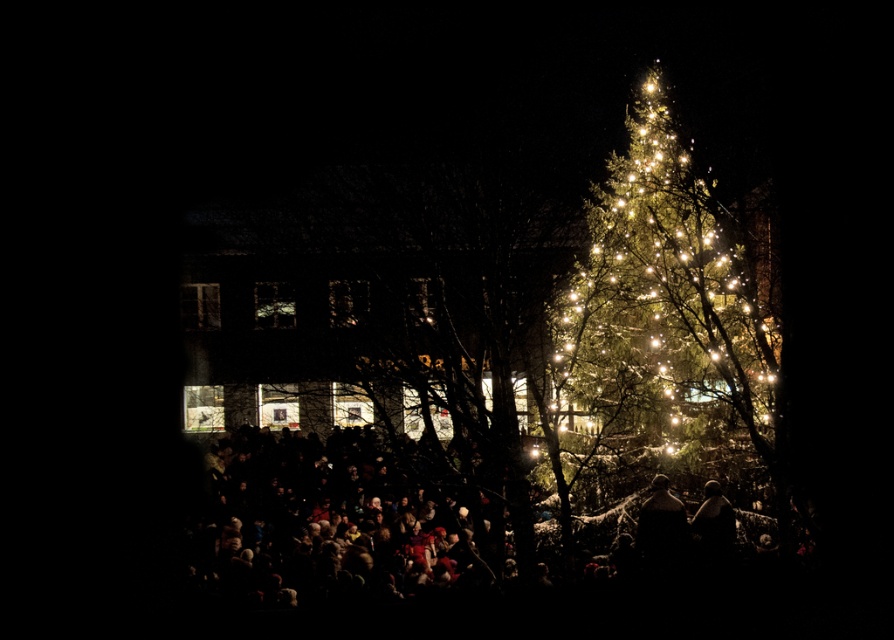
Question: Can you confirm if illuminated green pine at right is positioned to the right of brown leather jacket at lower right?

Choices:
 (A) no
 (B) yes

Answer: (A)

Question: Which object appears closest to the camera in this image?

Choices:
 (A) snow-covered crowd at lower center
 (B) brown leather jacket at lower right
 (C) illuminated green pine at right

Answer: (A)

Question: Can you confirm if illuminated green pine at right is positioned above brown leather jacket at lower right?

Choices:
 (A) no
 (B) yes

Answer: (B)

Question: Can you confirm if snow-covered crowd at lower center is thinner than brown leather jacket at lower right?

Choices:
 (A) yes
 (B) no

Answer: (B)

Question: Which point is closer to the camera?

Choices:
 (A) [237, 605]
 (B) [762, 312]
 (C) [724, 499]

Answer: (B)

Question: Which point appears closest to the camera in this image?

Choices:
 (A) (221, 474)
 (B) (692, 378)

Answer: (B)